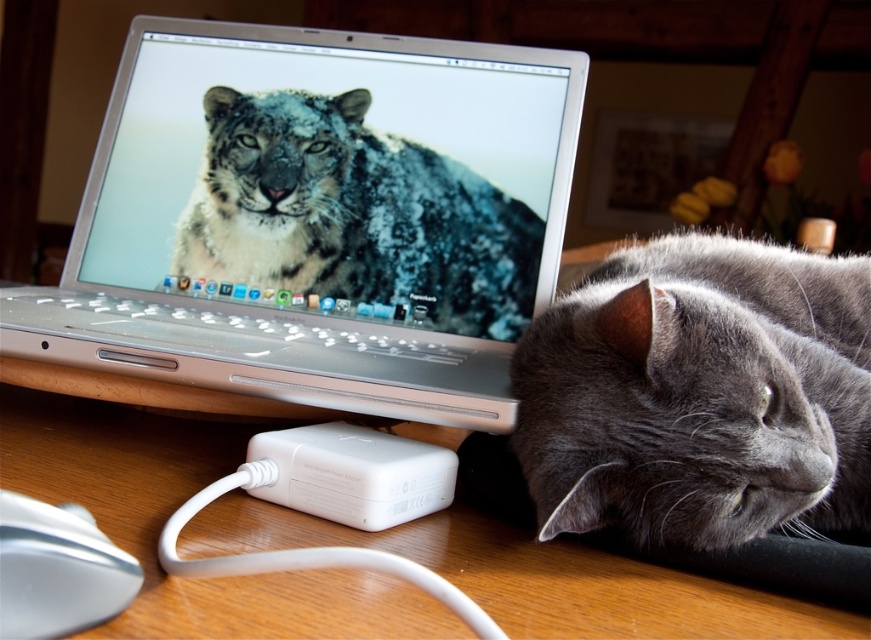
Question: Which point appears closest to the camera in this image?

Choices:
 (A) (99, 291)
 (B) (84, 509)
 (C) (517, 294)

Answer: (B)

Question: Observing the image, what is the correct spatial positioning of silver metallic laptop at upper left in reference to gray soft fur cat at right?

Choices:
 (A) above
 (B) below

Answer: (A)

Question: Which of the following is the farthest from the observer?

Choices:
 (A) coord(842,620)
 (B) coord(375,296)
 (C) coord(436,493)
 (D) coord(720,323)

Answer: (B)

Question: Which of the following is the farthest from the observer?

Choices:
 (A) pos(716,358)
 (B) pos(302,618)
 (C) pos(326,436)
 (D) pos(157,150)

Answer: (D)

Question: Does white plastic power adapter at lower center have a lesser width compared to white glossy mouse at lower left?

Choices:
 (A) yes
 (B) no

Answer: (B)

Question: Where is wooden table at lower center located in relation to white glossy mouse at lower left in the image?

Choices:
 (A) above
 (B) below

Answer: (B)